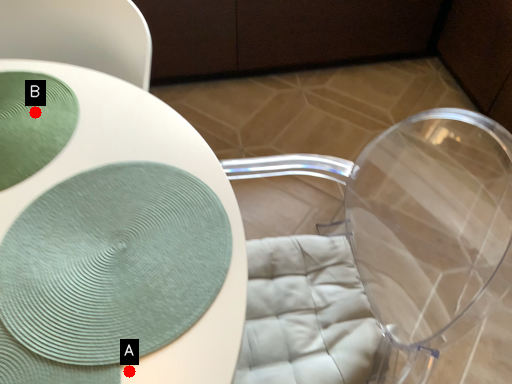
Question: Two points are circled on the image, labeled by A and B beside each circle. Which point is farther to the camera?

Choices:
 (A) A is further
 (B) B is further

Answer: (B)